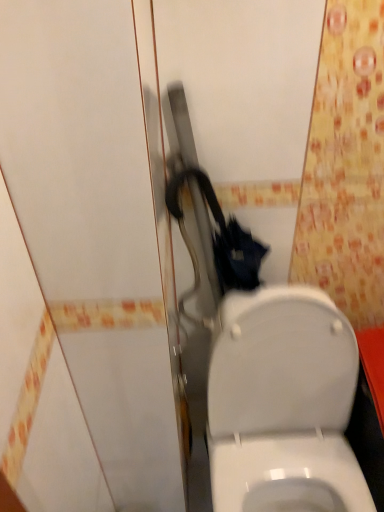
At what (x,y) coordinates should I click in order to perform the action: click on white glossy toilet at lower right. Please return your answer as a coordinate pair (x, y). The height and width of the screenshot is (512, 384). Looking at the image, I should click on tap(283, 404).

Image resolution: width=384 pixels, height=512 pixels. What do you see at coordinates (283, 404) in the screenshot? I see `white glossy toilet at lower right` at bounding box center [283, 404].

Locate an element on the screen. The image size is (384, 512). white glossy toilet at lower right is located at coordinates (283, 404).